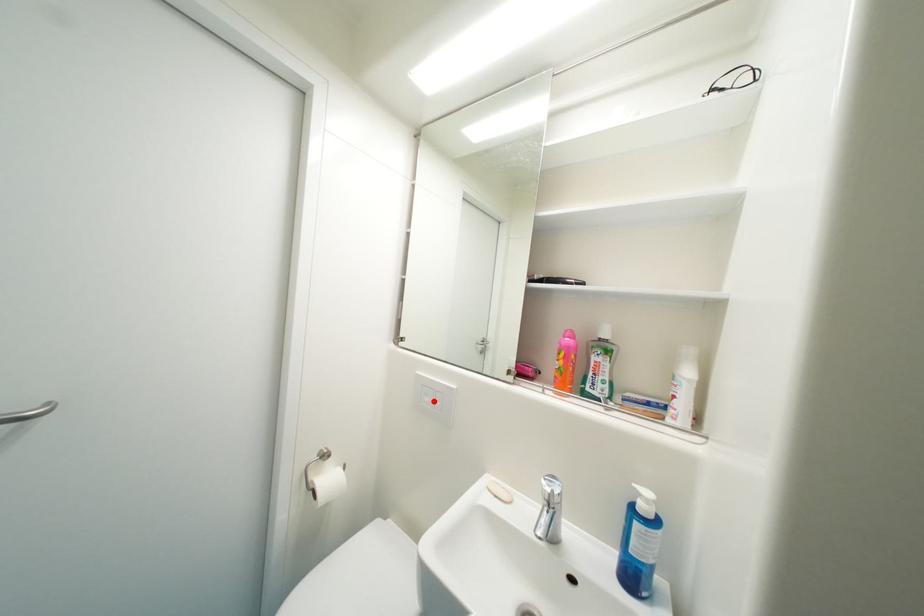
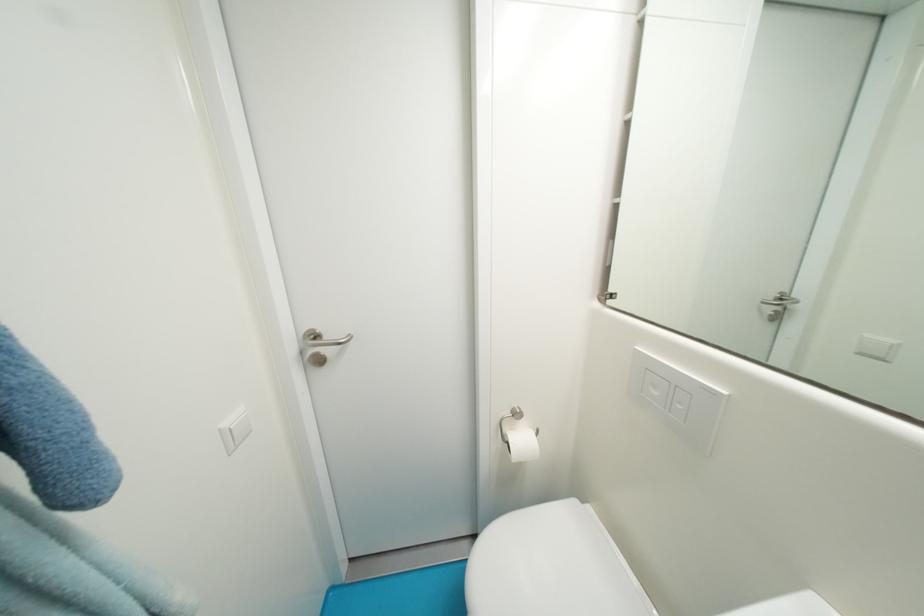
The point at the highlighted location is marked in the first image. Where is the corresponding point in the second image?

(662, 395)